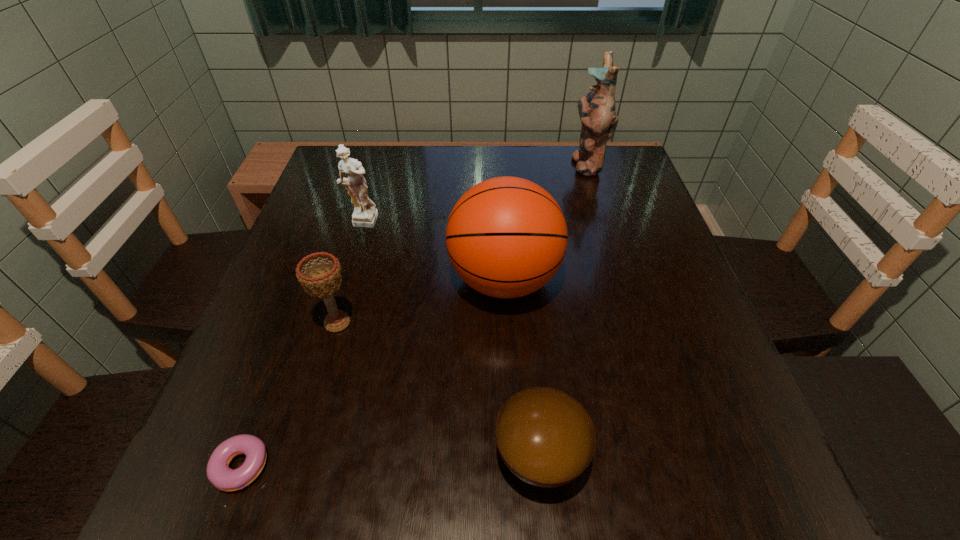
The image size is (960, 540). I want to click on the rightmost object, so click(597, 110).

Image resolution: width=960 pixels, height=540 pixels. Identify the location of the tallest object. (597, 110).

Locate an element on the screen. Image resolution: width=960 pixels, height=540 pixels. basketball is located at coordinates (506, 237).

Find the location of a particular element. the nearer figurine is located at coordinates (365, 215).

This screenshot has height=540, width=960. I want to click on the fifth nearest object, so click(x=365, y=215).

Locate an element on the screen. The width and height of the screenshot is (960, 540). the third shortest object is located at coordinates (320, 274).

The image size is (960, 540). Find the location of `bowl`. bowl is located at coordinates pos(545,437).

Identify the location of doughnut. This screenshot has height=540, width=960. (219, 474).

At what (x,y) coordinates should I click in order to perform the action: click on free spot located 0.330m on the front-facing side of the rightmost object. Please return your answer as a coordinate pair (x, y). The width and height of the screenshot is (960, 540). Looking at the image, I should click on (450, 164).

Find the location of `vacant space located 0.360m on the front-facing side of the rightmost object`. vacant space located 0.360m on the front-facing side of the rightmost object is located at coordinates (440, 164).